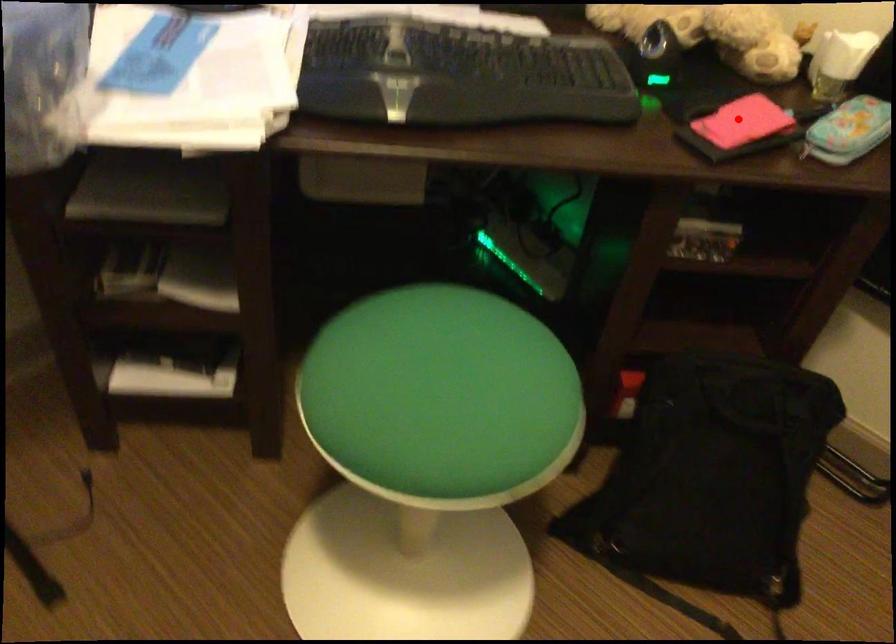
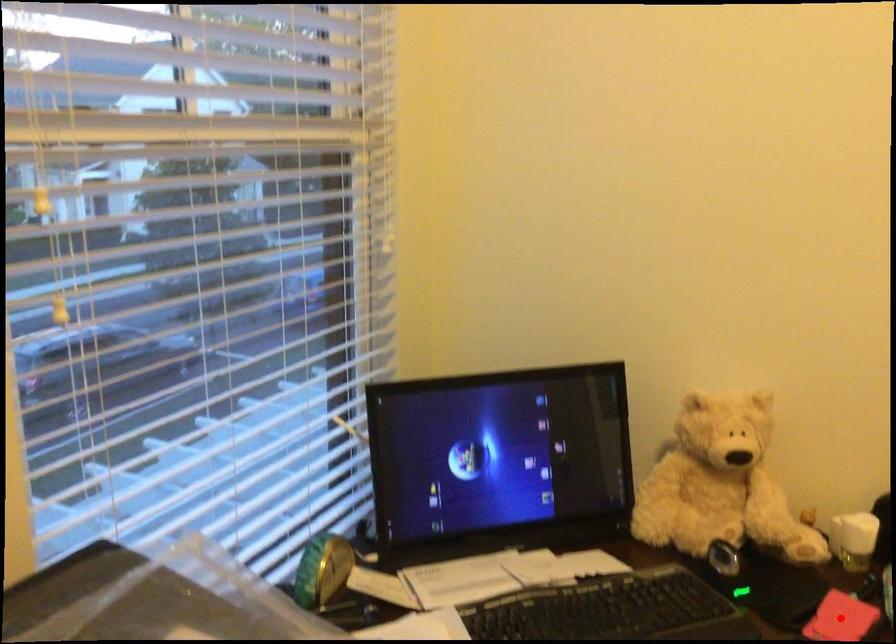
I am providing you with two images of the same scene from different viewpoints. A red point is marked on the first image and another point is marked on the second image. Is the red point in image1 aligned with the point shown in image2?

Yes